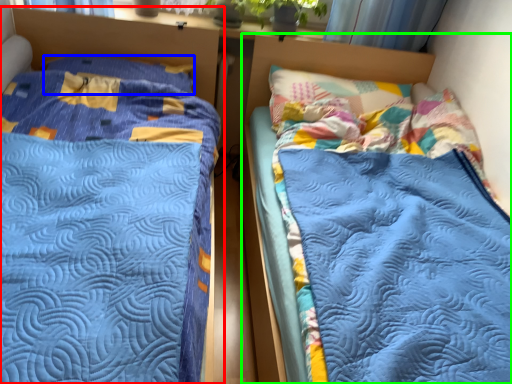
Question: Estimate the real-world distances between objects in this image. Which object is closer to bed (highlighted by a red box), pillow (highlighted by a blue box) or bed (highlighted by a green box)?

Choices:
 (A) pillow
 (B) bed

Answer: (A)